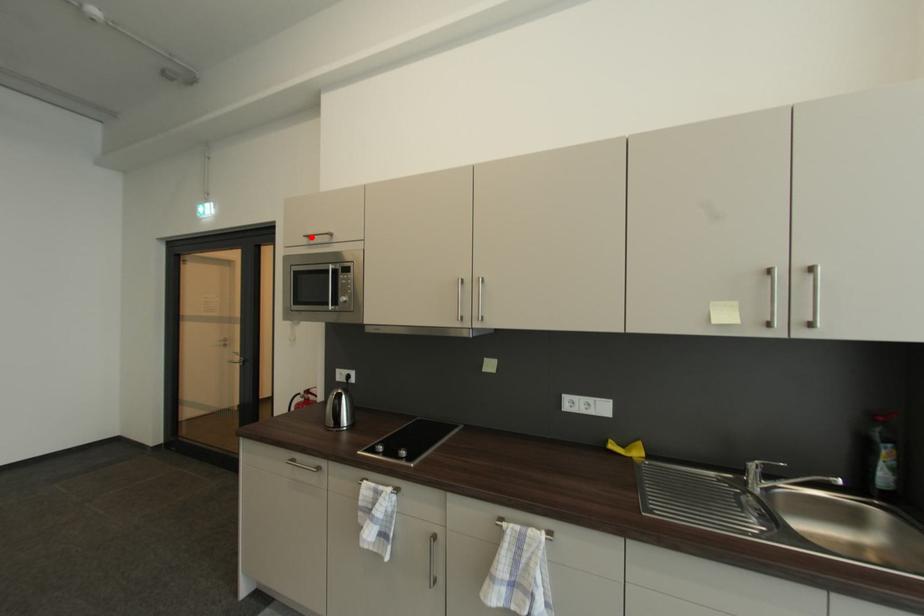
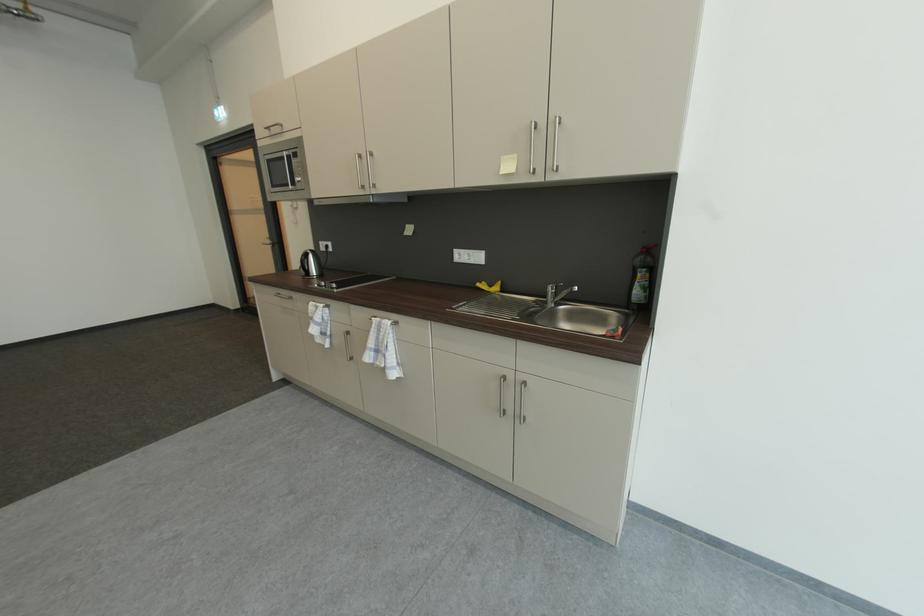
In the second image, find the point that corresponds to the highlighted location in the first image.

(273, 130)